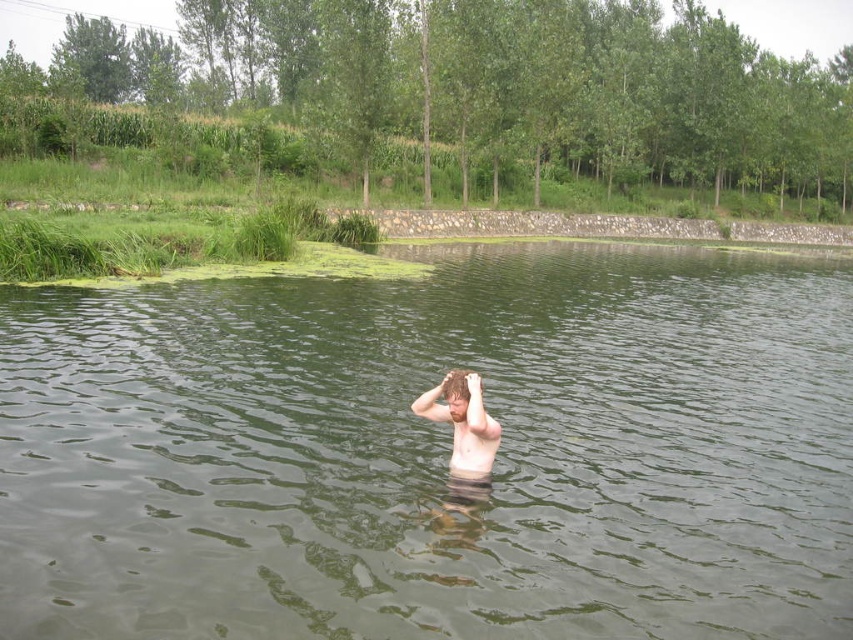
Question: Is light brown skin at center positioned before brown hair at center?

Choices:
 (A) yes
 (B) no

Answer: (A)

Question: Which object is the closest to the light brown skin at center?

Choices:
 (A) skinny white skin at center
 (B) green murky water at center

Answer: (A)

Question: Which point is farther to the camera?

Choices:
 (A) skinny white skin at center
 (B) brown hair at center
 (C) green murky water at center

Answer: (B)

Question: Can you confirm if green murky water at center is positioned below brown hair at center?

Choices:
 (A) yes
 (B) no

Answer: (B)

Question: Based on their relative distances, which object is farther from the green murky water at center?

Choices:
 (A) skinny white skin at center
 (B) light brown skin at center
 (C) brown hair at center

Answer: (C)

Question: Does light brown skin at center appear over skinny white skin at center?

Choices:
 (A) yes
 (B) no

Answer: (A)